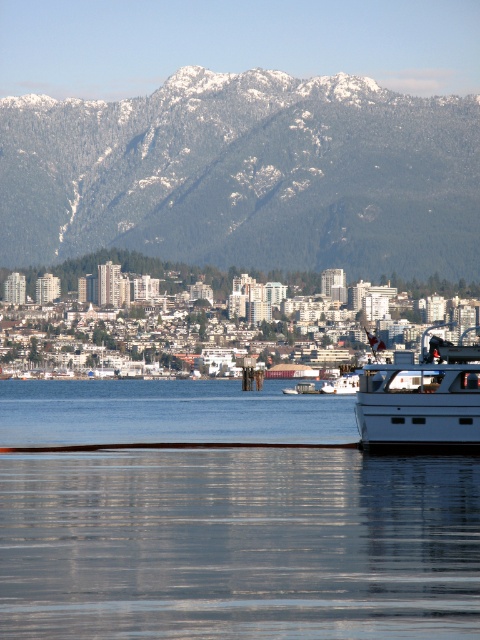
You are a photographer planning to take a photo of the snowy forested mountain at upper center and the white matte boat at right. Based on their positions, which object will appear closer to the camera in the final photo?

The snowy forested mountain at upper center will appear closer to the camera because it is positioned further to the viewer than the white matte boat at right, meaning it is nearer in the visual plane.

You are a drone operator tasked with capturing aerial footage of the snowy forested mountain at upper center and the white matte boat at right. Your drone has a maximum flight range of 75 meters. Can you fly the drone from the mountain to the boat without exceeding its range?

The snowy forested mountain at upper center and white matte boat at right are 76.75 meters apart. Since the drone can only fly up to 75 meters, it cannot reach the boat from the mountain without exceeding its range.